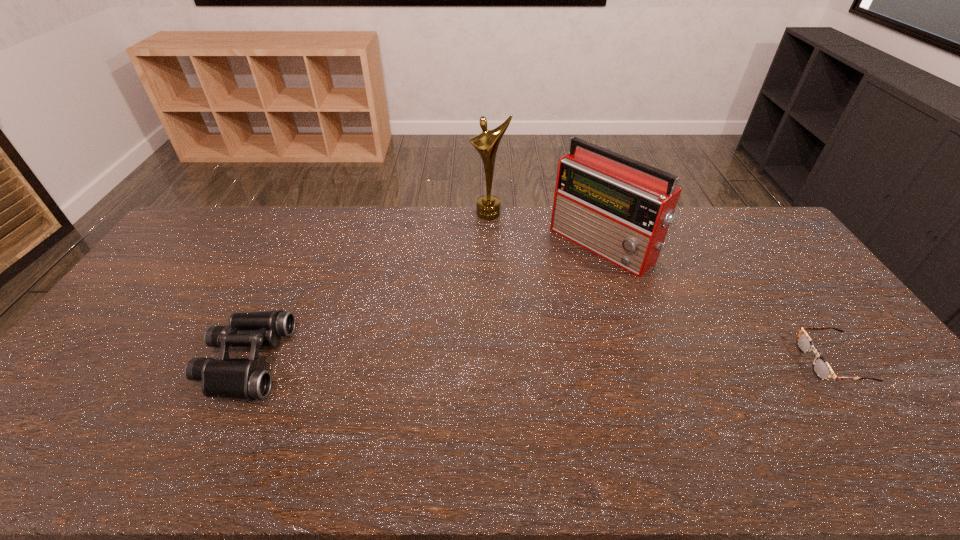
This screenshot has width=960, height=540. I want to click on vacant space positioned 0.240m on the front-facing side of the radio receiver, so click(x=526, y=305).

I want to click on free spot located on the front-facing side of the radio receiver, so click(x=501, y=325).

This screenshot has width=960, height=540. I want to click on vacant space located on the front-facing side of the radio receiver, so click(x=506, y=321).

Identify the location of vacant space located on the front-facing side of the award. This screenshot has height=540, width=960. (491, 235).

The image size is (960, 540). In order to click on vacant space located 0.390m on the front-facing side of the award in this screenshot , I will do `click(494, 294)`.

You are a GUI agent. You are given a task and a screenshot of the screen. Output one action in this format:
    pyautogui.click(x=<x>, y=<y>)
    Task: Click on the free spot located 0.210m on the front-facing side of the award
    The image size is (960, 540).
    Given the screenshot: What is the action you would take?
    492,256

Where is `radio receiver that is at the far edge`? The width and height of the screenshot is (960, 540). radio receiver that is at the far edge is located at coordinates (620, 209).

Identify the location of award situated at the far edge. (488, 206).

Locate an element on the screen. object that is at the near edge is located at coordinates click(x=235, y=378).

I want to click on object located at the right edge, so click(x=821, y=368).